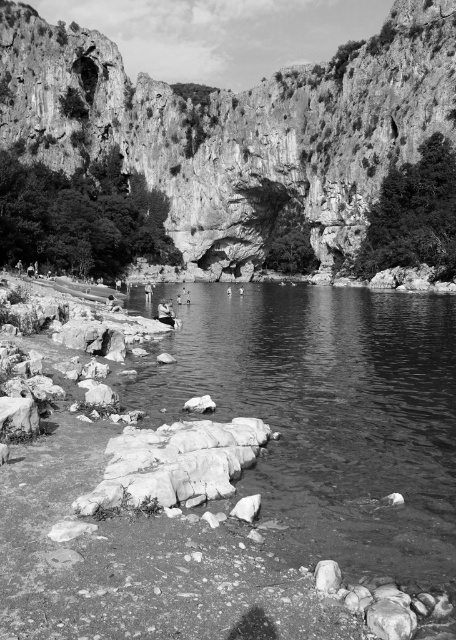
You are planning to take a swim in the transparent water at lower left. What should you be cautious about due to the presence of the smooth gray rock at lower left?

The transparent water at lower left is positioned over smooth gray rock at lower left, so you should be cautious of slippery rocks beneath the water.

Looking at this image, you are planning to cross the transparent water at lower left to reach the smooth gray rock at lower left. Given that the water is transparent, can you see the bottom clearly to avoid obstacles?

The transparent water at lower left is wider than the smooth gray rock at lower left, so it might be challenging to see the bottom clearly due to its greater width, making it harder to navigate safely.

You are standing at the edge of the rugged stone cliff at upper center and want to see the transparent water at lower left. In which direction should you look to see it?

You should look downward because the transparent water at lower left is behind rugged stone cliff at upper center, meaning it is located below the cliff.